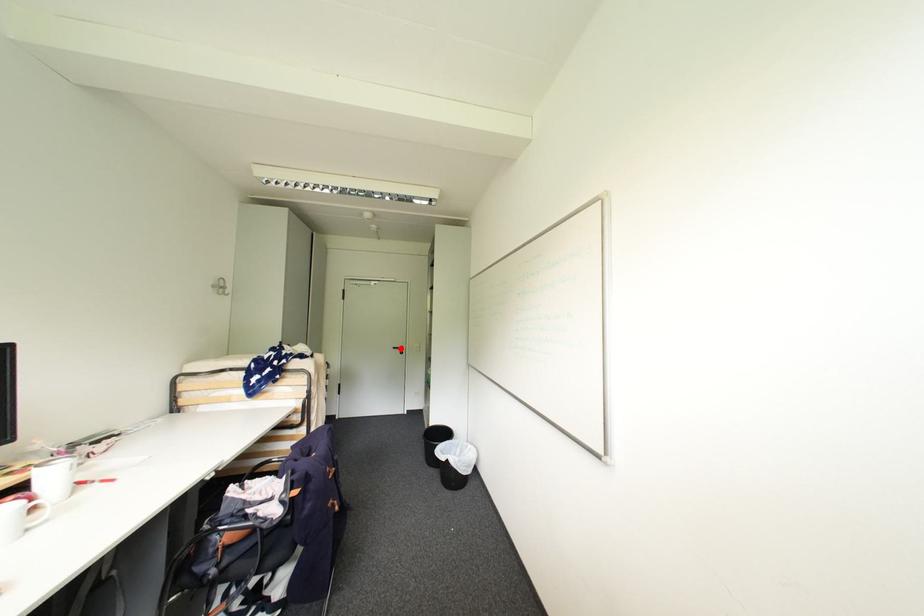
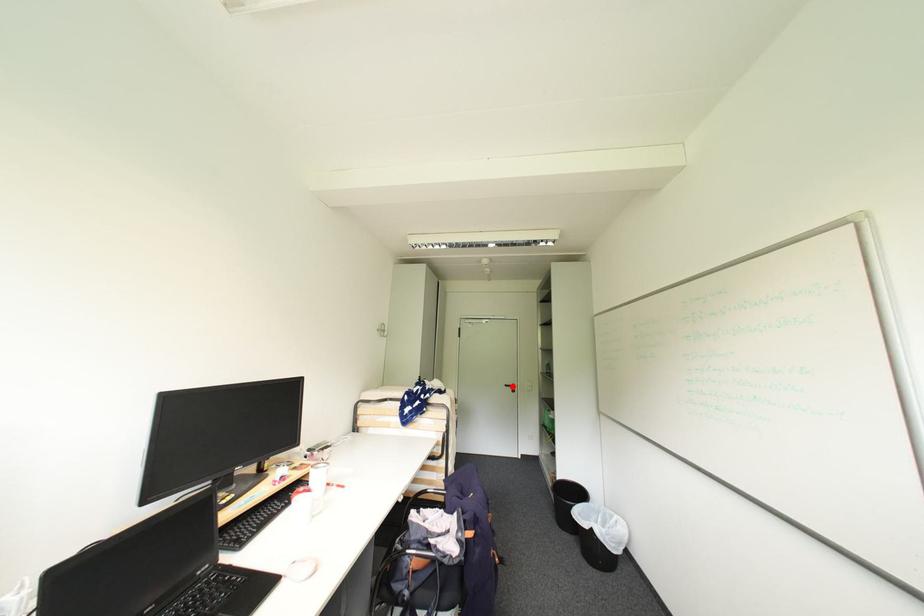
I am providing you with two images of the same scene from different viewpoints. A red point is marked on the first image and another point is marked on the second image. Is the marked point in image1 the same physical position as the marked point in image2?

Yes